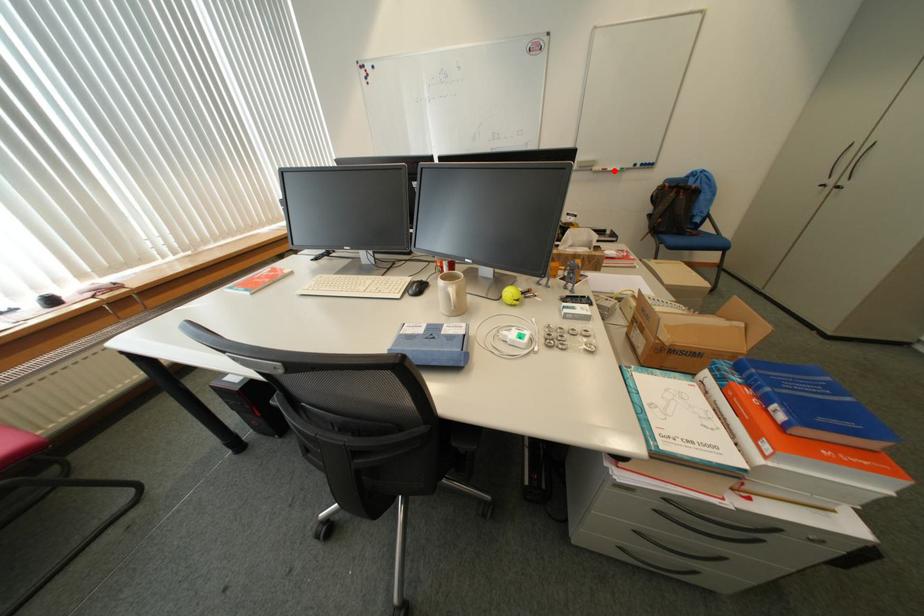
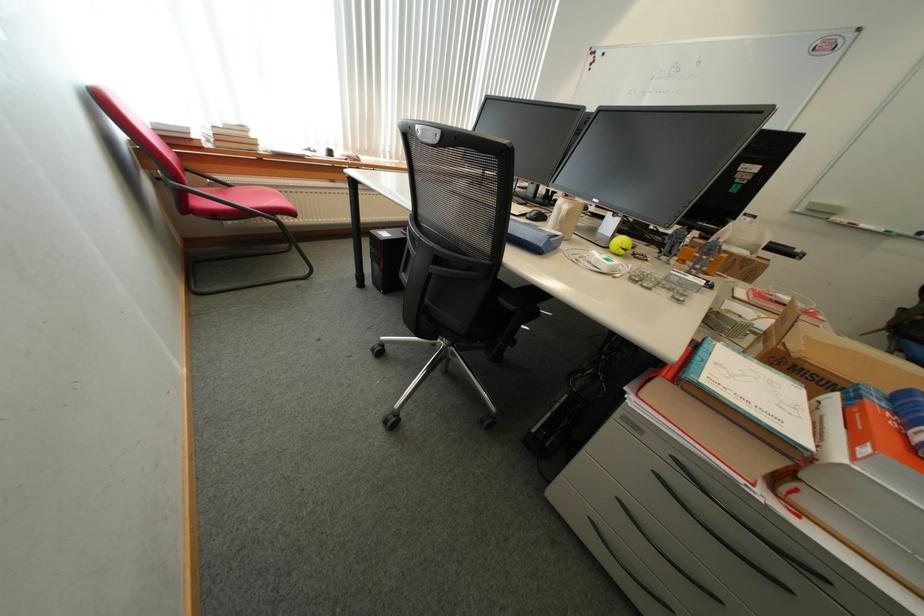
Question: I am providing you with two images of the same scene from different viewpoints. Given a red point in image1, look at the same physical point in image2. Is it:

Choices:
 (A) Closer to the viewpoint
 (B) Farther from the viewpoint

Answer: (B)